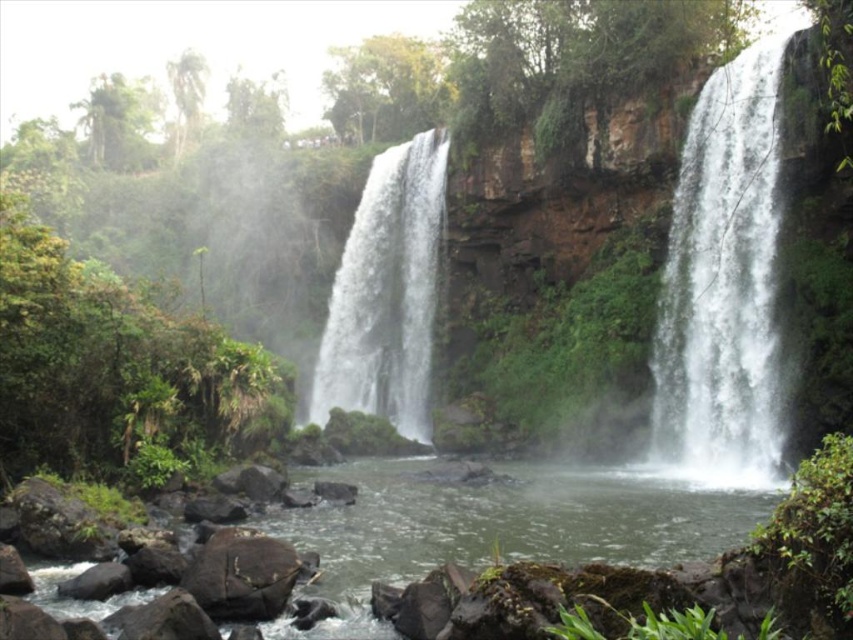
You are standing at the base of the waterfalls and want to take a photo. There are two points marked in the scene, point 1 at coordinates point (566, 529) and point 2 at coordinates point (357, 310). Which point should you focus on to capture the mist rising from the falls more clearly?

Point 1 at coordinates point (566, 529) is closer to the camera than point (357, 310), so focusing on point 1 will capture the mist rising from the falls more clearly.